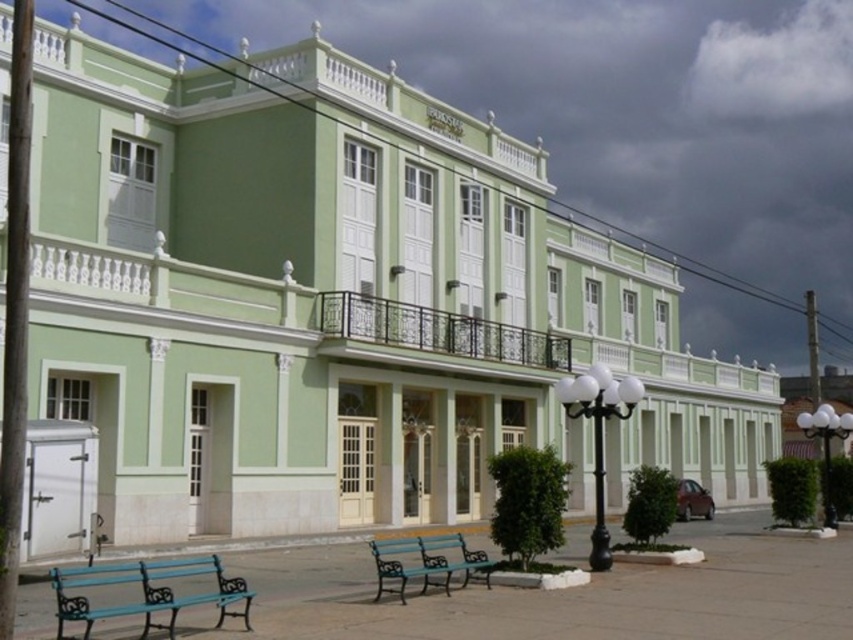
Is teal painted wood bench at lower left smaller than teal painted wood bench at center?

Incorrect, teal painted wood bench at lower left is not smaller in size than teal painted wood bench at center.

The height and width of the screenshot is (640, 853). What do you see at coordinates (146, 592) in the screenshot?
I see `teal painted wood bench at lower left` at bounding box center [146, 592].

Between point (225, 579) and point (426, 586), which one is positioned behind?

Point (225, 579)

Where is `teal painted wood bench at lower left`? teal painted wood bench at lower left is located at coordinates (146, 592).

The image size is (853, 640). I want to click on black metal streetlight at center, so click(598, 435).

Between point (592, 563) and point (488, 580), which one is positioned behind?

The point (592, 563) is behind.

The height and width of the screenshot is (640, 853). What do you see at coordinates (598, 435) in the screenshot?
I see `black metal streetlight at center` at bounding box center [598, 435].

You are a GUI agent. You are given a task and a screenshot of the screen. Output one action in this format:
    pyautogui.click(x=<x>, y=<y>)
    Task: Click on the black metal streetlight at center
    
    Given the screenshot: What is the action you would take?
    pyautogui.click(x=598, y=435)

Can you confirm if black metal streetlight at center is thinner than white glass lamp post at right?

Indeed, black metal streetlight at center has a lesser width compared to white glass lamp post at right.

Does point (601, 524) lie behind point (811, 429)?

No, (601, 524) is closer to viewer.

This screenshot has width=853, height=640. I want to click on black metal streetlight at center, so (x=598, y=435).